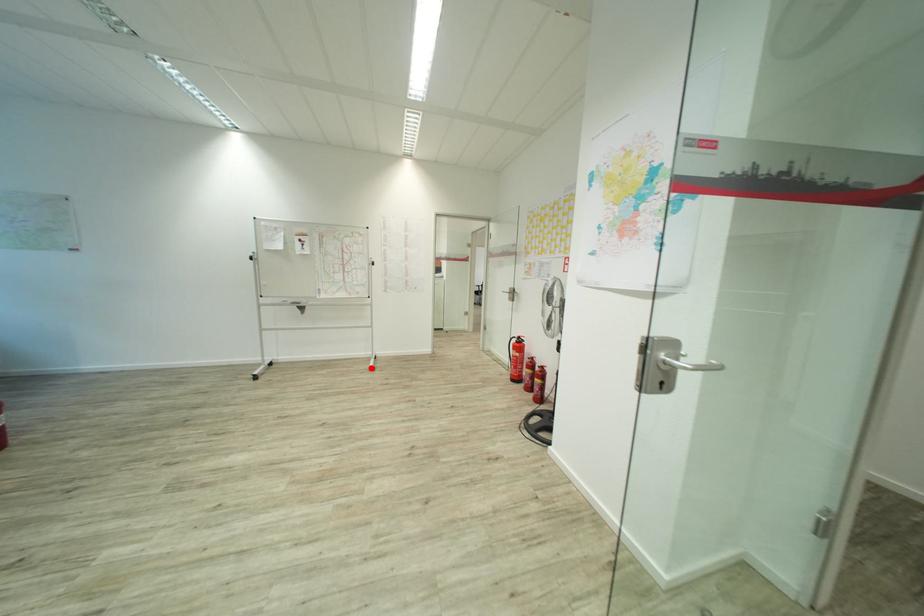
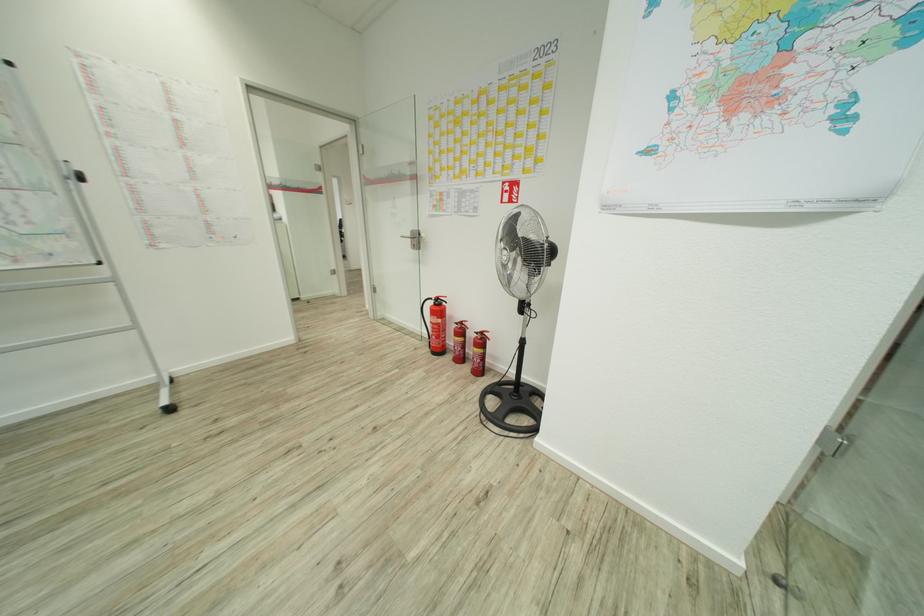
Question: I am providing you with two images of the same scene from different viewpoints. A red point is shown in image1. For the corresponding object point in image2, is it positioned nearer or farther from the camera?

Choices:
 (A) Nearer
 (B) Farther

Answer: (A)